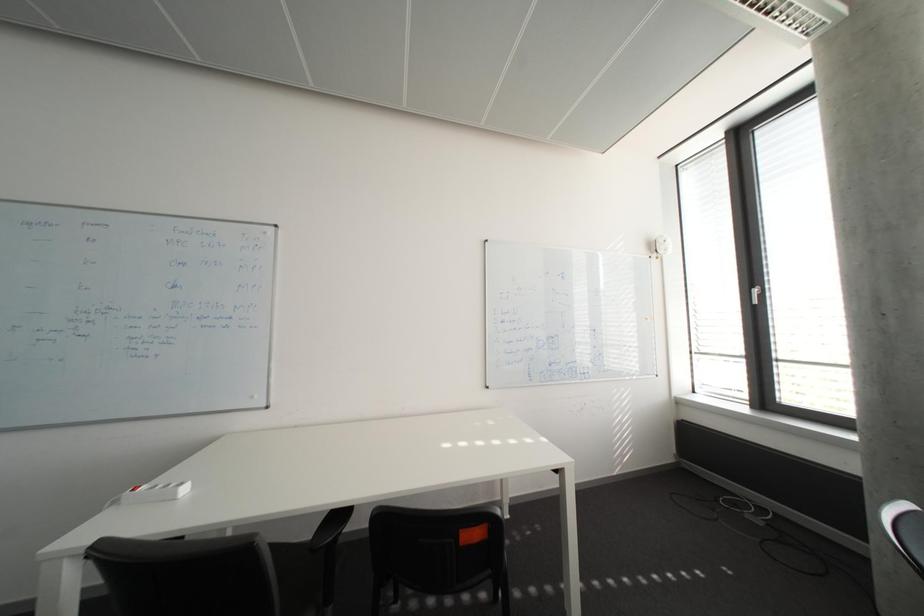
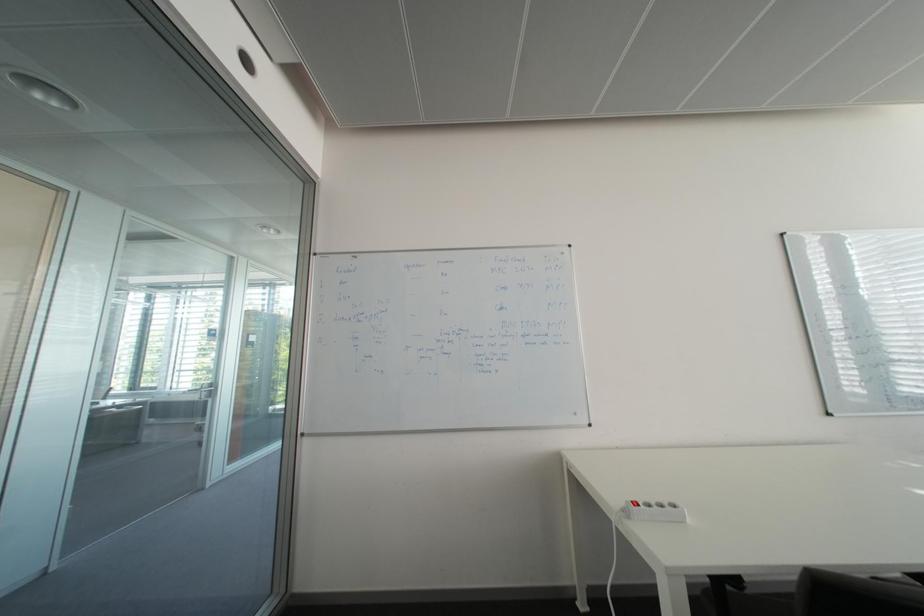
Question: Which direction would the cameraman need to move to produce the second image? Reply with the corresponding letter.

Choices:
 (A) Left
 (B) Right
 (C) Forward
 (D) Backward

Answer: (A)